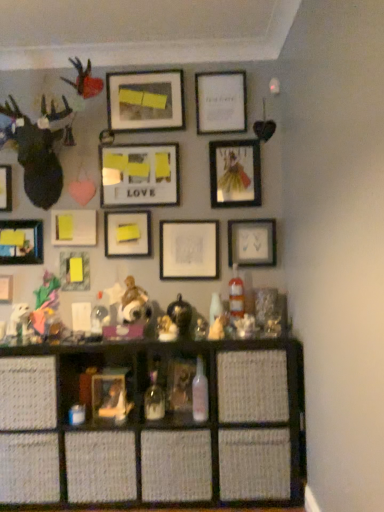
How much space does matte black picture frame at left, placed as the second picture frame when sorted from left to right, occupy horizontally?

1.86 inches.

This screenshot has width=384, height=512. Describe the element at coordinates (252, 243) in the screenshot. I see `matte glass picture frame at center-right, which appears as the 1th picture frame when viewed from the right` at that location.

Where is `matte brown figurine at center, which is counted as the 2th toy, starting from the right`? matte brown figurine at center, which is counted as the 2th toy, starting from the right is located at coordinates (134, 303).

This screenshot has width=384, height=512. In order to click on matte black picture frame at left, acting as the 1th picture frame starting from the left in this screenshot , I will do `click(5, 188)`.

Where is `metallic gold picture frame at center right, the second picture frame from the right`? metallic gold picture frame at center right, the second picture frame from the right is located at coordinates (235, 173).

Locate an element on the screen. The width and height of the screenshot is (384, 512). the 3rd picture frame to the left of the metallic gold teapot at center, which ranks as the 2th toy in left-to-right order, counting from the anchor's position is located at coordinates (127, 234).

Considering the points (180, 311) and (145, 216), which point is in front, point (180, 311) or point (145, 216)?

The point (180, 311) is closer.

Does metallic gold teapot at center, the 1th toy viewed from the right, have a larger size compared to matte yellow paper at center, placed as the 7th picture frame when sorted from right to left?

No, metallic gold teapot at center, the 1th toy viewed from the right, is not bigger than matte yellow paper at center, placed as the 7th picture frame when sorted from right to left.

Is metallic gold teapot at center, the 1th toy viewed from the right, closer to camera compared to matte yellow paper at center, the sixth picture frame when ordered from left to right?

Yes, it is.

From a real-world perspective, is white paper at upper center, the 10th picture frame positioned from the left, positioned over matte wooden picture frame at center, which is counted as the 7th picture frame, starting from the left, based on gravity?

Indeed, from a real-world perspective, white paper at upper center, the 10th picture frame positioned from the left, stands above matte wooden picture frame at center, which is counted as the 7th picture frame, starting from the left.

Is white paper at upper center, acting as the 3th picture frame starting from the right, oriented away from matte wooden picture frame at center, which is counted as the 7th picture frame, starting from the left?

No, white paper at upper center, acting as the 3th picture frame starting from the right,'s orientation is not away from matte wooden picture frame at center, which is counted as the 7th picture frame, starting from the left.

There is a white paper at upper center, acting as the 3th picture frame starting from the right. At what (x,y) coordinates should I click in order to perform the action: click on the 2nd picture frame below it (from the image's perspective). Please return your answer as a coordinate pair (x, y). The image size is (384, 512). Looking at the image, I should click on tap(139, 175).

Is point (238, 112) less distant than point (104, 180)?

Yes, it is.

In the scene shown: Is matte wooden picture frame at center, which is counted as the 7th picture frame, starting from the left, to the right of matte black picture frame at left, the 10th picture frame viewed from the right, from the viewer's perspective?

Yes.

Which is closer to the camera, (107, 155) or (9, 225)?

Point (107, 155) is closer to the camera than point (9, 225).

Does matte wooden picture frame at center, which is counted as the 7th picture frame, starting from the left, have a lesser height compared to matte black picture frame at left, positioned as the 3th picture frame in left-to-right order?

No.

Is matte wooden picture frame at center, positioned as the 6th picture frame in right-to-left order, next to matte black picture frame at left, positioned as the 3th picture frame in left-to-right order?

No, matte wooden picture frame at center, positioned as the 6th picture frame in right-to-left order, is not in contact with matte black picture frame at left, positioned as the 3th picture frame in left-to-right order.

Between yellow paper at center, positioned as the 8th picture frame in right-to-left order, and matte black picture frame at left, placed as the second picture frame when sorted from left to right, which one has larger width?

With larger width is yellow paper at center, positioned as the 8th picture frame in right-to-left order.

From the image's perspective, is yellow paper at center, which is the fifth picture frame in left-to-right order, under matte black picture frame at left, placed as the second picture frame when sorted from left to right?

No, from the image's perspective, yellow paper at center, which is the fifth picture frame in left-to-right order, is not below matte black picture frame at left, placed as the second picture frame when sorted from left to right.

How distant is yellow paper at center, which is the fifth picture frame in left-to-right order, from matte black picture frame at left, placed as the second picture frame when sorted from left to right?

yellow paper at center, which is the fifth picture frame in left-to-right order, is 17.47 inches from matte black picture frame at left, placed as the second picture frame when sorted from left to right.

Which is behind, point (226, 143) or point (229, 239)?

The point (229, 239) is more distant.

Can we say metallic gold picture frame at center right, placed as the 11th picture frame when sorted from left to right, lies outside matte glass picture frame at center-right, which appears as the 1th picture frame when viewed from the right?

Yes, metallic gold picture frame at center right, placed as the 11th picture frame when sorted from left to right, is located beyond the bounds of matte glass picture frame at center-right, which appears as the 1th picture frame when viewed from the right.

Which is more to the left, metallic gold picture frame at center right, placed as the 11th picture frame when sorted from left to right, or matte glass picture frame at center-right, the twelfth picture frame viewed from the left?

Positioned to the left is metallic gold picture frame at center right, placed as the 11th picture frame when sorted from left to right.

Can you confirm if matte glass picture frame at center-right, which appears as the 1th picture frame when viewed from the right, is positioned to the left of metallic gold teapot at center, which ranks as the 2th toy in left-to-right order?

Incorrect, matte glass picture frame at center-right, which appears as the 1th picture frame when viewed from the right, is not on the left side of metallic gold teapot at center, which ranks as the 2th toy in left-to-right order.

Find the location of a particular element. toy that is the 2nd object directly below the matte glass picture frame at center-right, the twelfth picture frame viewed from the left (from a real-world perspective) is located at coordinates (180, 314).

Looking at the image, does matte glass picture frame at center-right, which appears as the 1th picture frame when viewed from the right, seem bigger or smaller compared to metallic gold teapot at center, the 1th toy viewed from the right?

Clearly, matte glass picture frame at center-right, which appears as the 1th picture frame when viewed from the right, is larger in size than metallic gold teapot at center, the 1th toy viewed from the right.

Is matte glass picture frame at center-right, which appears as the 1th picture frame when viewed from the right, oriented away from metallic gold teapot at center, which ranks as the 2th toy in left-to-right order?

No, matte glass picture frame at center-right, which appears as the 1th picture frame when viewed from the right,'s orientation is not away from metallic gold teapot at center, which ranks as the 2th toy in left-to-right order.

At what (x,y) coordinates should I click in order to perform the action: click on the 1st picture frame counting from the right of the white paper at center, the fourth picture frame positioned from the right. Please return your answer as a coordinate pair (x, y). Looking at the image, I should click on (221, 102).

How far apart are white paper at center, the fourth picture frame positioned from the right, and white paper at upper center, acting as the 3th picture frame starting from the right?

white paper at center, the fourth picture frame positioned from the right, and white paper at upper center, acting as the 3th picture frame starting from the right, are 65.56 centimeters apart.

Who is smaller, white paper at center, arranged as the 9th picture frame when viewed from the left, or white paper at upper center, the 10th picture frame positioned from the left?

Smaller between the two is white paper at center, arranged as the 9th picture frame when viewed from the left.

Can you tell me how much white paper at center, arranged as the 9th picture frame when viewed from the left, and white paper at upper center, the 10th picture frame positioned from the left, differ in facing direction?

They differ by 1.89 degrees in their facing directions.

Locate an element on the screen. The height and width of the screenshot is (512, 384). the 3rd picture frame to the left of the metallic gold teapot at center, which ranks as the 2th toy in left-to-right order, starting your count from the anchor is located at coordinates click(x=127, y=234).

Which picture frame is the 3rd one when counting from the right side of the matte wooden picture frame at center, which is counted as the 7th picture frame, starting from the left? Please provide its 2D coordinates.

[(221, 102)]

Based on their spatial positions, is matte black picture frame at left, which is counted as the 11th picture frame, starting from the right, or matte glass picture frame at center-right, the twelfth picture frame viewed from the left, further from woven wood shelf at lower center?

The object further to woven wood shelf at lower center is matte black picture frame at left, which is counted as the 11th picture frame, starting from the right.

Considering their positions, is metallic gold teapot at center, the 1th toy viewed from the right, positioned closer to matte brown figurine at center, which is counted as the 2th toy, starting from the right, than matte black picture frame at left, acting as the 1th picture frame starting from the left?

metallic gold teapot at center, the 1th toy viewed from the right, is positioned closer to the anchor matte brown figurine at center, which is counted as the 2th toy, starting from the right.

From the image, which object appears to be nearer to metallic gold picture frame at center right, placed as the 11th picture frame when sorted from left to right, matte black picture frame at upper center, the eighth picture frame in the left-to-right sequence, or matte yellow paper at center, the sixth picture frame when ordered from left to right?

matte black picture frame at upper center, the eighth picture frame in the left-to-right sequence, lies closer to metallic gold picture frame at center right, placed as the 11th picture frame when sorted from left to right, than the other object.

From the image, which object appears to be nearer to matte black picture frame at left, acting as the twelfth picture frame starting from the right, white paper at upper center, the 10th picture frame positioned from the left, or matte black picture frame at upper center, which is the fifth picture frame in right-to-left order?

Among the two, matte black picture frame at upper center, which is the fifth picture frame in right-to-left order, is located nearer to matte black picture frame at left, acting as the twelfth picture frame starting from the right.

Looking at this image, estimate the real-world distances between objects in this image. Which object is closer to matte brown figurine at center, which is counted as the 2th toy, starting from the right, matte wooden picture frame at center, positioned as the 6th picture frame in right-to-left order, or matte black picture frame at left, acting as the twelfth picture frame starting from the right?

matte wooden picture frame at center, positioned as the 6th picture frame in right-to-left order, is positioned closer to the anchor matte brown figurine at center, which is counted as the 2th toy, starting from the right.

Looking at the image, which one is located further to matte wooden picture frame at center, positioned as the 6th picture frame in right-to-left order, matte yellow paper at center, the sixth picture frame when ordered from left to right, or matte black picture frame at left, the 10th picture frame viewed from the right?

matte black picture frame at left, the 10th picture frame viewed from the right.

Based on their spatial positions, is matte black picture frame at left, acting as the 1th picture frame starting from the left, or metallic gold picture frame at center right, the second picture frame from the right, further from yellow matte picture frame at lower left, acting as the fourth picture frame starting from the left?

metallic gold picture frame at center right, the second picture frame from the right.

Based on their spatial positions, is white paper at center, the fourth picture frame positioned from the right, or matte yellow paper at center, the sixth picture frame when ordered from left to right, further from matte black picture frame at left, positioned as the 3th picture frame in left-to-right order?

Among the two, white paper at center, the fourth picture frame positioned from the right, is located further to matte black picture frame at left, positioned as the 3th picture frame in left-to-right order.

The height and width of the screenshot is (512, 384). Find the location of `shelf between matte black picture frame at left, which is counted as the 11th picture frame, starting from the right, and metallic gold teapot at center, which ranks as the 2th toy in left-to-right order, from left to right`. shelf between matte black picture frame at left, which is counted as the 11th picture frame, starting from the right, and metallic gold teapot at center, which ranks as the 2th toy in left-to-right order, from left to right is located at coordinates (183, 428).

Locate an element on the screen. Image resolution: width=384 pixels, height=512 pixels. shelf located between matte black picture frame at left, positioned as the 3th picture frame in left-to-right order, and matte glass picture frame at center-right, the twelfth picture frame viewed from the left, in the left-right direction is located at coordinates (183, 428).

Identify the location of toy located between matte black picture frame at left, placed as the second picture frame when sorted from left to right, and matte wooden picture frame at center, which is counted as the 7th picture frame, starting from the left, in the left-right direction. (134, 303).

Where is `toy between matte wooden picture frame at center, positioned as the 6th picture frame in right-to-left order, and metallic gold teapot at center, which ranks as the 2th toy in left-to-right order, from top to bottom`? toy between matte wooden picture frame at center, positioned as the 6th picture frame in right-to-left order, and metallic gold teapot at center, which ranks as the 2th toy in left-to-right order, from top to bottom is located at coordinates (134, 303).